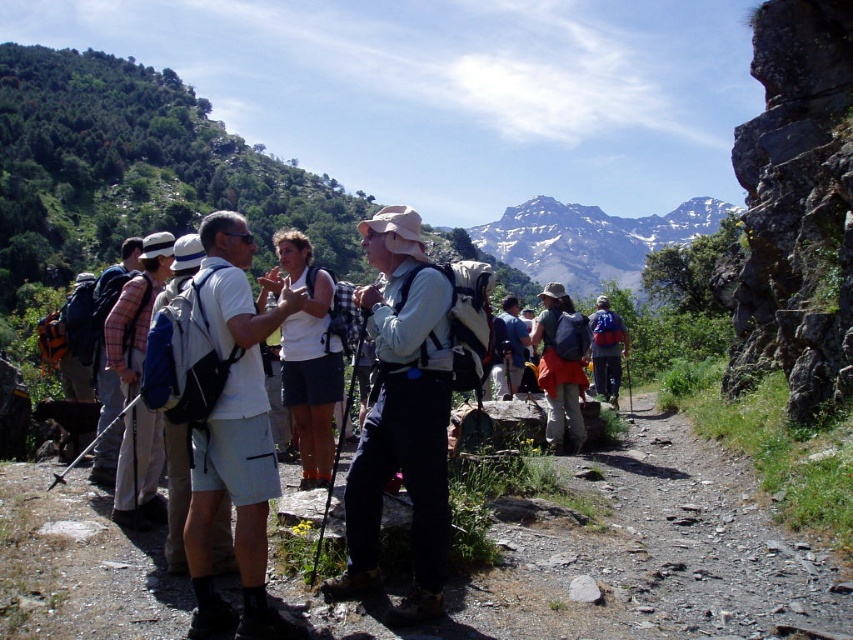
Looking at this image, is white matte shirt at center below matte orange backpack at center-right?

Indeed, white matte shirt at center is positioned under matte orange backpack at center-right.

Which is in front, point (306, 317) or point (546, 394)?

Point (306, 317) is more forward.

Where is `white matte shirt at center`? white matte shirt at center is located at coordinates (306, 355).

Looking at this image, does matte khaki pants at center appear over snowy rocky mountain at upper center?

Actually, matte khaki pants at center is below snowy rocky mountain at upper center.

Between matte khaki pants at center and snowy rocky mountain at upper center, which one has more height?

snowy rocky mountain at upper center is taller.

What are the coordinates of `matte khaki pants at center` in the screenshot? It's located at (401, 413).

How distant is matte khaki pants at center from plaid fabric shirt at left?

matte khaki pants at center and plaid fabric shirt at left are 8.26 meters apart from each other.

Does point (381, 417) come closer to viewer compared to point (129, 499)?

That is True.

The width and height of the screenshot is (853, 640). Describe the element at coordinates (401, 413) in the screenshot. I see `matte khaki pants at center` at that location.

Locate an element on the screen. matte khaki pants at center is located at coordinates (401, 413).